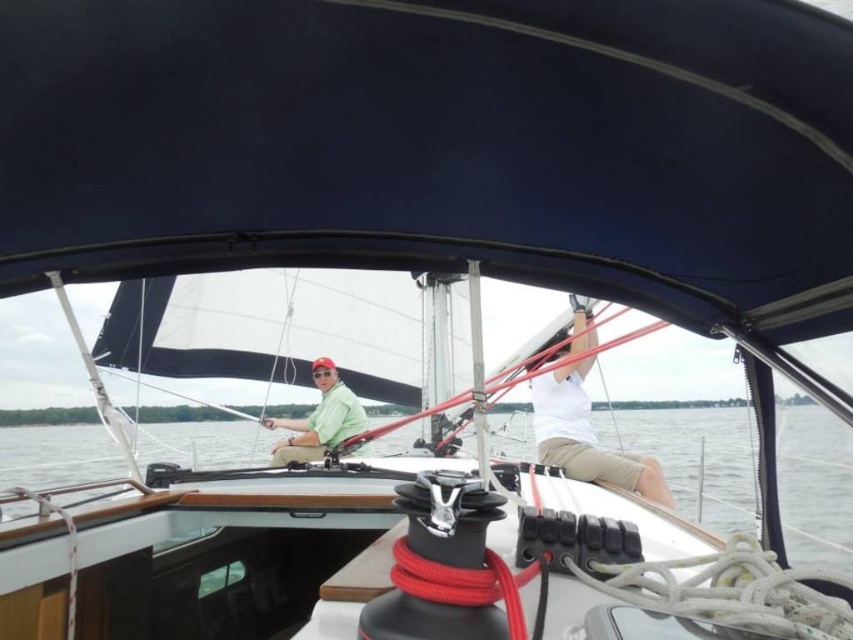
Question: Which object is farther from the camera taking this photo?

Choices:
 (A) white matte shirt at center
 (B) clear water at center
 (C) matte green shirt at center

Answer: (C)

Question: Where is clear water at center located in relation to matte green shirt at center in the image?

Choices:
 (A) left
 (B) right

Answer: (A)

Question: Does clear water at center have a larger size compared to matte green shirt at center?

Choices:
 (A) yes
 (B) no

Answer: (A)

Question: Which point is farther to the camera?

Choices:
 (A) (706, 490)
 (B) (305, 444)
 (C) (625, 476)

Answer: (A)

Question: Can you confirm if clear water at center is wider than matte green shirt at center?

Choices:
 (A) no
 (B) yes

Answer: (B)

Question: Which object is positioned closest to the white matte shirt at center?

Choices:
 (A) matte green shirt at center
 (B) clear water at center

Answer: (B)